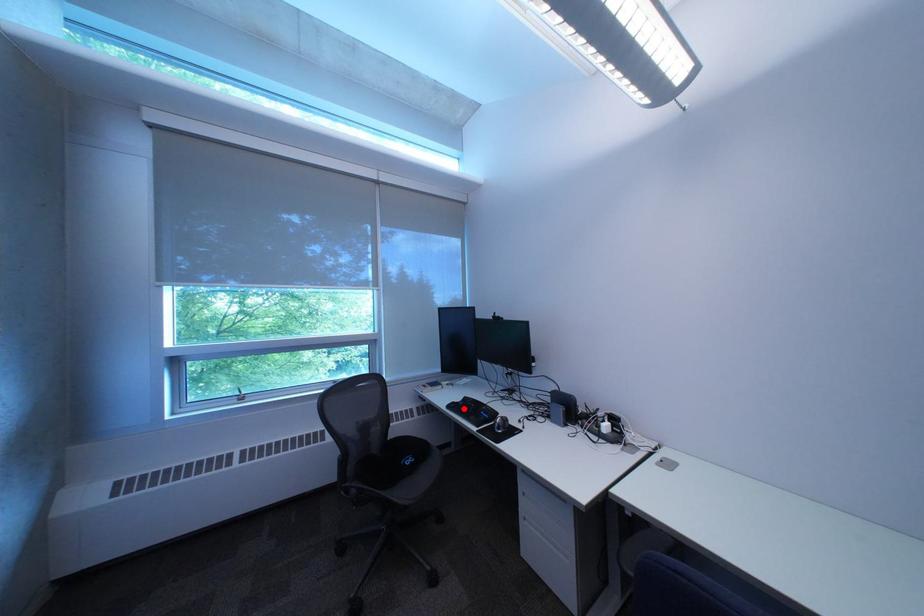
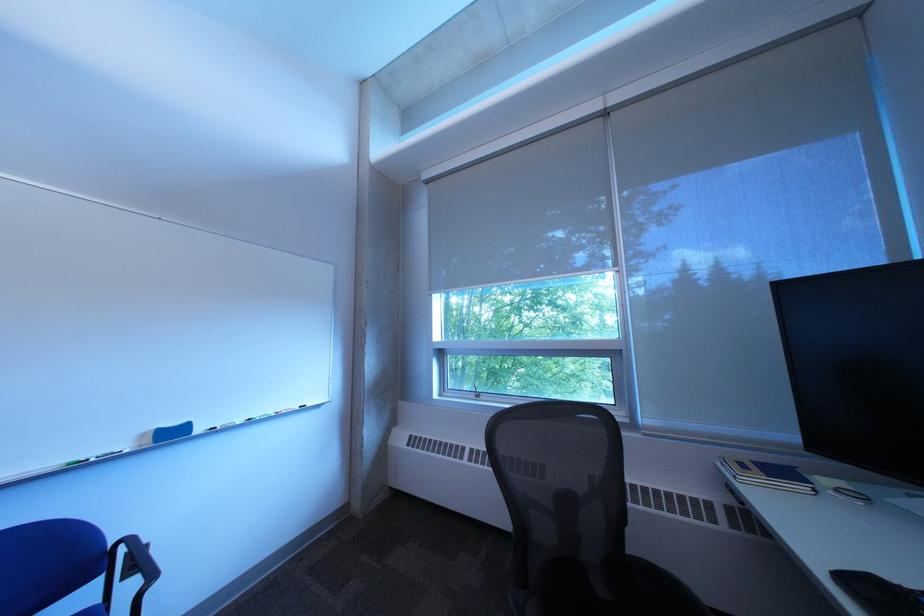
The point at the highlighted location is marked in the first image. Where is the corresponding point in the second image?

(860, 582)